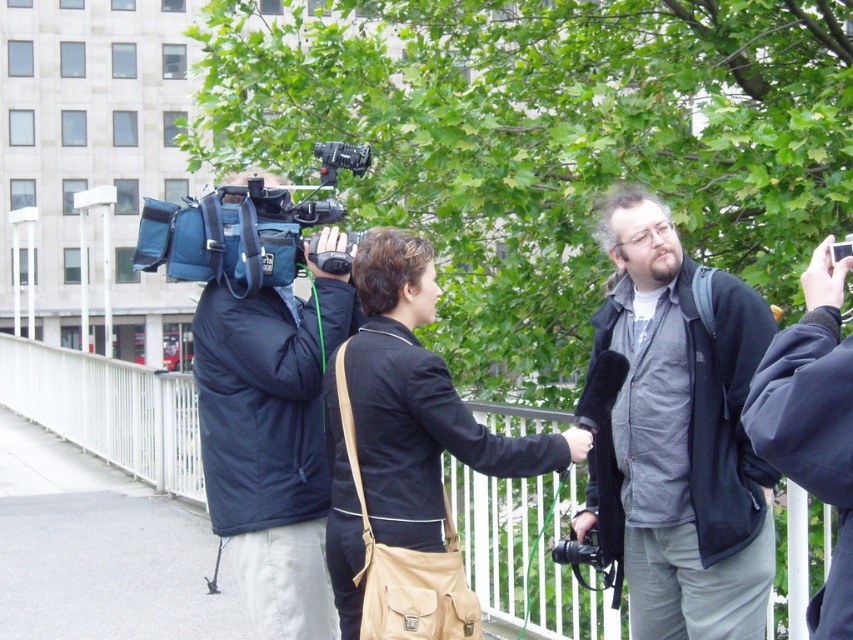
Consider the image. Who is shorter, white metal fence at center or black leather jacket at center?

With less height is black leather jacket at center.

Is point (25, 397) behind point (341, 554)?

Yes, it is behind point (341, 554).

The image size is (853, 640). Describe the element at coordinates (109, 410) in the screenshot. I see `white metal fence at center` at that location.

Where is `white metal fence at center`? The width and height of the screenshot is (853, 640). white metal fence at center is located at coordinates tap(109, 410).

Describe the element at coordinates (679, 436) in the screenshot. I see `dark gray fleece jacket at center` at that location.

How distant is dark gray fleece jacket at center from white metal fence at center?

dark gray fleece jacket at center is 5.84 feet from white metal fence at center.

Does point (682, 403) lie behind point (160, 465)?

No, (682, 403) is in front of (160, 465).

Identify the location of dark gray fleece jacket at center. (679, 436).

Which is more to the right, dark gray fleece jacket at center or black leather jacket at center?

Positioned to the right is dark gray fleece jacket at center.

Is point (691, 266) positioned in front of point (511, 449)?

No, (691, 266) is further to viewer.

Identify the location of dark gray fleece jacket at center. (679, 436).